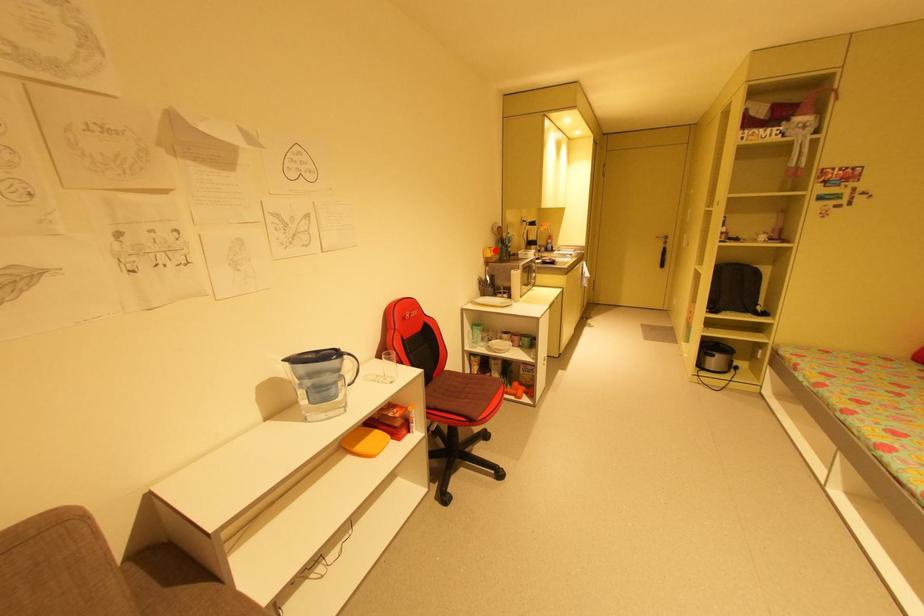
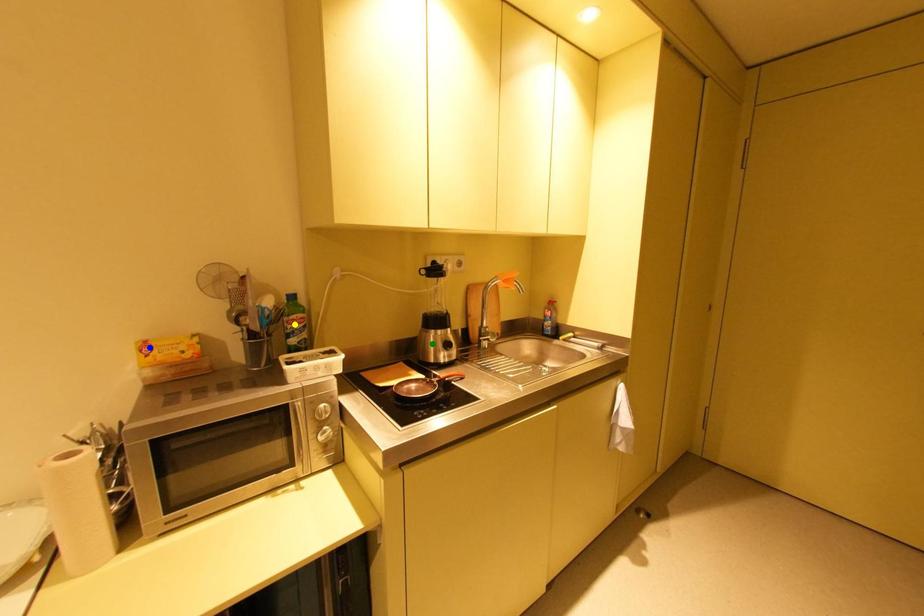
Question: I am providing you with two images of the same scene from different viewpoints. A red point is marked on the first image. You are given multiple points on the second image. Which point in image 2 is actually the same real-world point as the red point in image 1?

Choices:
 (A) green point
 (B) blue point
 (C) yellow point

Answer: (B)